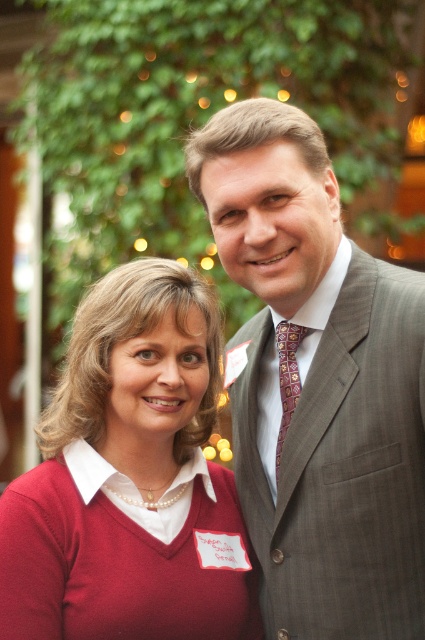
Is gray suit at center further to camera compared to patterned silk tie at center?

No, it is in front of patterned silk tie at center.

Based on the photo, does gray suit at center lie in front of patterned silk tie at center?

Yes, gray suit at center is in front of patterned silk tie at center.

Between point (402, 358) and point (291, 403), which one is positioned behind?

The point (291, 403) is behind.

The image size is (425, 640). I want to click on gray suit at center, so click(x=317, y=384).

What do you see at coordinates (129, 480) in the screenshot?
I see `matte red sweater at left` at bounding box center [129, 480].

Find the location of `matte red sweater at left`. matte red sweater at left is located at coordinates (129, 480).

From the picture: Between gray suit at center and matte red sweater at left, which one appears on the left side from the viewer's perspective?

matte red sweater at left

Is point (365, 378) behind point (110, 324)?

No.

This screenshot has width=425, height=640. Find the location of `gray suit at center`. gray suit at center is located at coordinates (317, 384).